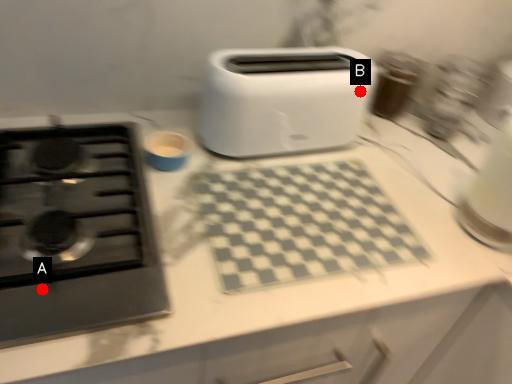
Question: Two points are circled on the image, labeled by A and B beside each circle. Which point is farther to the camera?

Choices:
 (A) A is further
 (B) B is further

Answer: (B)